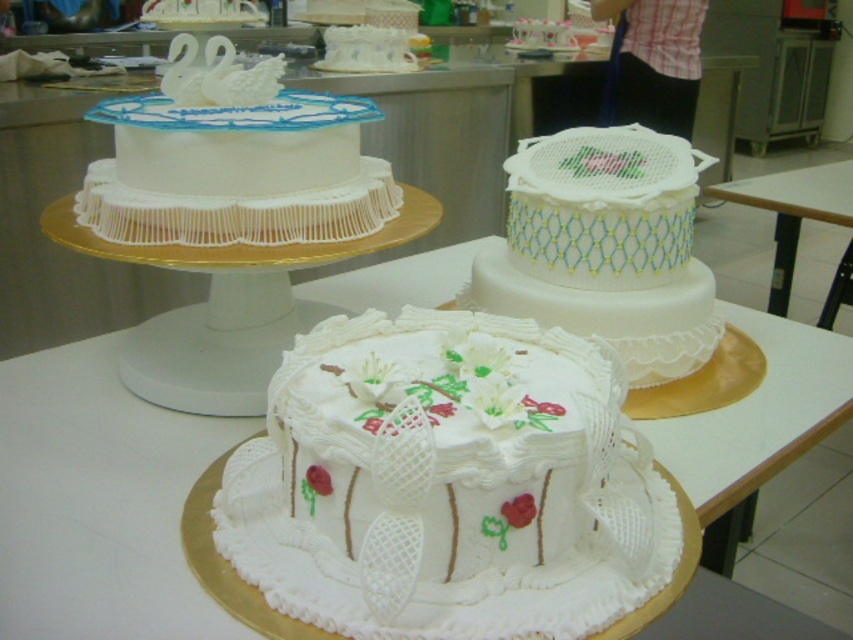
Question: Among these points, which one is nearest to the camera?

Choices:
 (A) (161, 4)
 (B) (544, 285)

Answer: (B)

Question: Which point is farther from the camera taking this photo?

Choices:
 (A) (202, 12)
 (B) (650, 374)

Answer: (A)

Question: Which of the following is the farthest from the observer?

Choices:
 (A) (573, 280)
 (B) (4, 371)

Answer: (B)

Question: Does white lace cake at center have a greater width compared to white fondant cake at upper center?

Choices:
 (A) no
 (B) yes

Answer: (B)

Question: In this image, where is white lace cake at center located relative to wooden table at center?

Choices:
 (A) below
 (B) above

Answer: (A)

Question: Can you confirm if white fondant cake at upper left is smaller than wooden table at center?

Choices:
 (A) no
 (B) yes

Answer: (B)